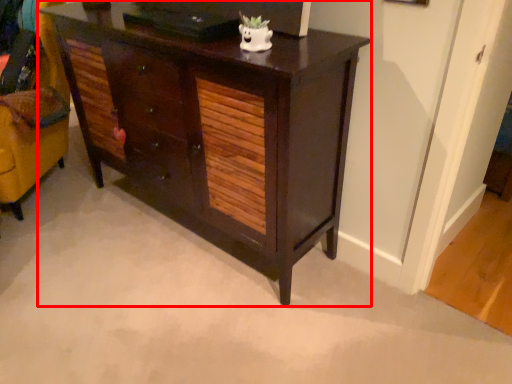
Question: In this image, where is chest of drawers (annotated by the red box) located relative to swivel chair?

Choices:
 (A) right
 (B) left

Answer: (A)